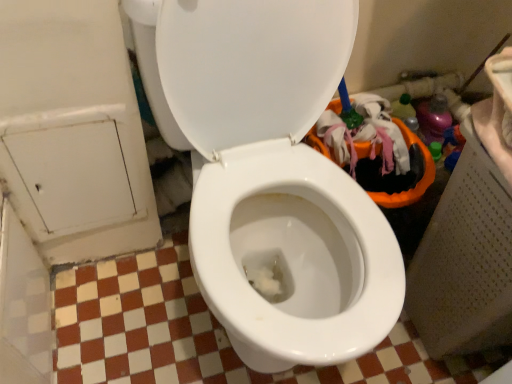
What is the approximate height of white powder at center?

3.46 centimeters.

Describe the element at coordinates (269, 275) in the screenshot. The image size is (512, 384). I see `white powder at center` at that location.

Find the location of `white powder at center`. white powder at center is located at coordinates (269, 275).

Image resolution: width=512 pixels, height=384 pixels. What do you see at coordinates (276, 178) in the screenshot? I see `white glossy toilet at center` at bounding box center [276, 178].

The image size is (512, 384). What are the coordinates of `white glossy toilet at center` in the screenshot? It's located at (276, 178).

The height and width of the screenshot is (384, 512). I want to click on white powder at center, so click(x=269, y=275).

Can you confirm if white glossy toilet at center is positioned to the left of white powder at center?

Correct, you'll find white glossy toilet at center to the left of white powder at center.

Considering the relative positions of white glossy toilet at center and white powder at center in the image provided, is white glossy toilet at center behind white powder at center?

That is False.

Is point (209, 206) behind point (254, 265)?

No, (209, 206) is closer to viewer.

From the image's perspective, is white glossy toilet at center under white powder at center?

Incorrect, from the image's perspective, white glossy toilet at center is higher than white powder at center.

From a real-world perspective, which object stands above the other?

white glossy toilet at center is physically above.

Between white glossy toilet at center and white powder at center, which one has larger width?

white glossy toilet at center is wider.

Considering the sizes of objects white glossy toilet at center and white powder at center in the image provided, who is taller, white glossy toilet at center or white powder at center?

With more height is white glossy toilet at center.

Between white glossy toilet at center and white powder at center, which one has larger size?

With larger size is white glossy toilet at center.

In the scene shown: Can we say white glossy toilet at center lies outside white powder at center?

Yes, white glossy toilet at center is not within white powder at center.

Is the surface of white glossy toilet at center in direct contact with white powder at center?

white glossy toilet at center is not next to white powder at center, and they're not touching.

Does white glossy toilet at center turn towards white powder at center?

Yes.

How many degrees apart are the facing directions of white glossy toilet at center and white powder at center?

The angular difference between white glossy toilet at center and white powder at center is 0.000445 degrees.

Locate an element on the screen. toilet located in front of the white powder at center is located at coordinates (276, 178).

Is white powder at center to the left of white glossy toilet at center from the viewer's perspective?

In fact, white powder at center is to the right of white glossy toilet at center.

Is white powder at center positioned in front of white glossy toilet at center?

No, the depth of white powder at center is greater than that of white glossy toilet at center.

Between point (267, 288) and point (377, 326), which one is positioned in front?

The point (377, 326) is more forward.

From the image's perspective, is white powder at center over white glossy toilet at center?

Incorrect, from the image's perspective, white powder at center is lower than white glossy toilet at center.

Looking at this image, from a real-world perspective, is white powder at center above or below white glossy toilet at center?

From a real-world perspective, white powder at center is physically below white glossy toilet at center.

Which object is thinner, white powder at center or white glossy toilet at center?

With smaller width is white powder at center.

Considering the relative sizes of white powder at center and white glossy toilet at center in the image provided, is white powder at center taller than white glossy toilet at center?

No, white powder at center is not taller than white glossy toilet at center.

Based on the photo, based on their sizes in the image, would you say white powder at center is bigger or smaller than white glossy toilet at center?

white powder at center is smaller than white glossy toilet at center.

Is white powder at center inside the boundaries of white glossy toilet at center, or outside?

The correct answer is: inside.

Would you consider white powder at center to be distant from white glossy toilet at center?

No.

Could you tell me if white powder at center is turned towards white glossy toilet at center?

Yes, white powder at center is aimed at white glossy toilet at center.

In the scene shown: How different are the orientations of white powder at center and white glossy toilet at center in degrees?

There is a 0.000445-degree angle between the facing directions of white powder at center and white glossy toilet at center.

Where is `toilet in front of the white powder at center`? The width and height of the screenshot is (512, 384). toilet in front of the white powder at center is located at coordinates (276, 178).

Find the location of a particular element. Image resolution: width=512 pixels, height=384 pixels. dust located behind the white glossy toilet at center is located at coordinates (269, 275).

Find the location of a particular element. dust that is on the right side of white glossy toilet at center is located at coordinates (269, 275).